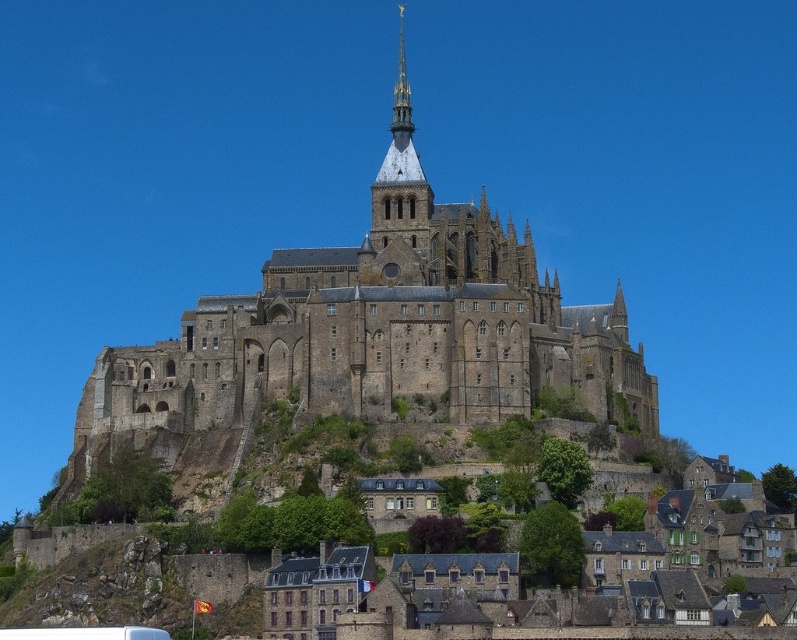
Does brown stone castle at center have a larger size compared to brown stone houses at lower center?

Correct, brown stone castle at center is larger in size than brown stone houses at lower center.

How much distance is there between brown stone castle at center and brown stone houses at lower center?

A distance of 128.39 feet exists between brown stone castle at center and brown stone houses at lower center.

Which is in front, point (419, 340) or point (351, 627)?

Positioned in front is point (351, 627).

Locate an element on the screen. The width and height of the screenshot is (797, 640). brown stone castle at center is located at coordinates (375, 332).